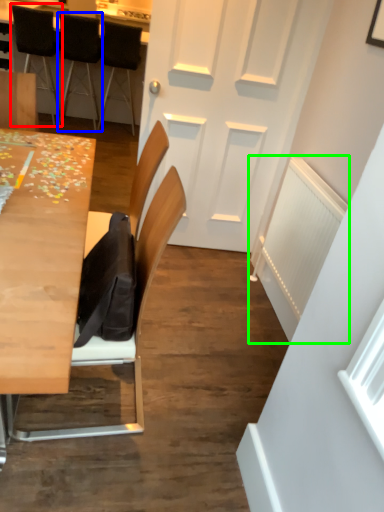
Question: Which object is the closest to the chair (highlighted by a red box)? Choose among these: chair (highlighted by a blue box) or radiator (highlighted by a green box).

Choices:
 (A) chair
 (B) radiator

Answer: (A)